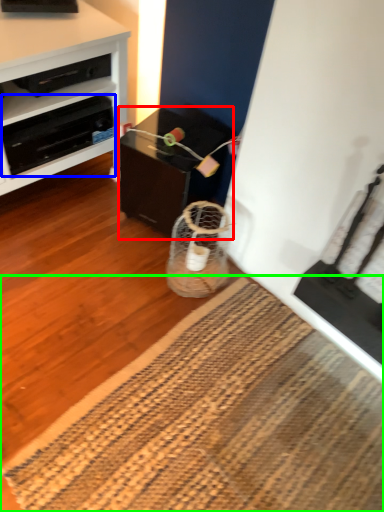
Question: Considering the real-world distances, which object is closest to table (highlighted by a red box)? drawer (highlighted by a blue box) or mat (highlighted by a green box).

Choices:
 (A) drawer
 (B) mat

Answer: (A)